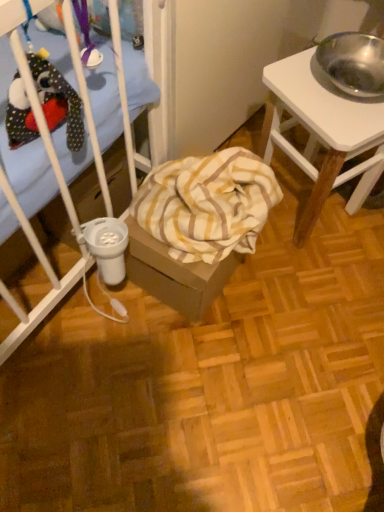
Question: From the image's perspective, relative to yellow striped fabric at center, is white wood desk at right above or below?

Choices:
 (A) below
 (B) above

Answer: (B)

Question: Choose the correct answer: Is white wood desk at right inside yellow striped fabric at center or outside it?

Choices:
 (A) inside
 (B) outside

Answer: (B)

Question: Looking at their shapes, would you say white wood desk at right is wider or thinner than yellow striped fabric at center?

Choices:
 (A) wide
 (B) thin

Answer: (A)

Question: Looking at their shapes, would you say yellow striped fabric at center is wider or thinner than white wood desk at right?

Choices:
 (A) thin
 (B) wide

Answer: (A)

Question: Visually, is yellow striped fabric at center positioned to the left or to the right of white wood desk at right?

Choices:
 (A) right
 (B) left

Answer: (B)

Question: Is yellow striped fabric at center inside the boundaries of white wood desk at right, or outside?

Choices:
 (A) inside
 (B) outside

Answer: (B)

Question: Relative to white wood desk at right, is yellow striped fabric at center in front or behind?

Choices:
 (A) front
 (B) behind

Answer: (B)